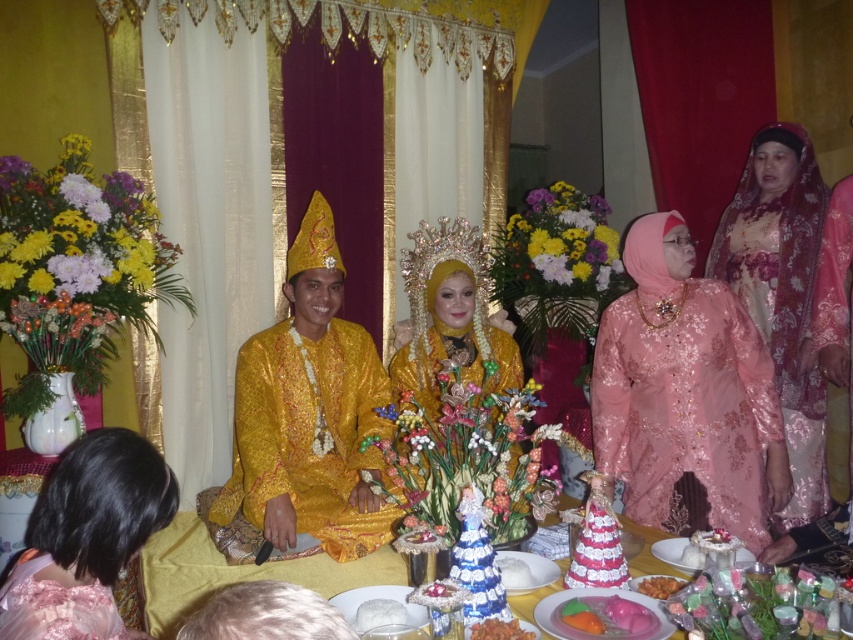
You are a guest at the wedding and you want to place a small gift between the shiny gold robe at center and the pink glossy candy at center. Where should you place it?

The shiny gold robe at center is positioned on the left side of pink glossy candy at center, so you should place the gift between them, to the right of the shiny gold robe at center and to the left of the pink glossy candy at center.

Looking at this image, you are a photographer positioned at the center of the room. You notice a gold sequined dress at center marked by point (451, 316). Where should you adjust your camera to capture the dress in the center of your photo?

The gold sequined dress at center is already at the center point (451, 316), so you don not need to adjust your camera. Keep it centered to capture the dress in the center of your photo.

From the picture: You are a guest at the wedding and want to take a photo of the shiny gold robe at center and the pink glossy candy at center on the table. Since the shiny gold robe is blocking the view of the candy, how can you adjust your position to see both items clearly?

The shiny gold robe at center is positioned over pink glossy candy at center, so you should move your camera angle slightly downward to see both items without obstruction.